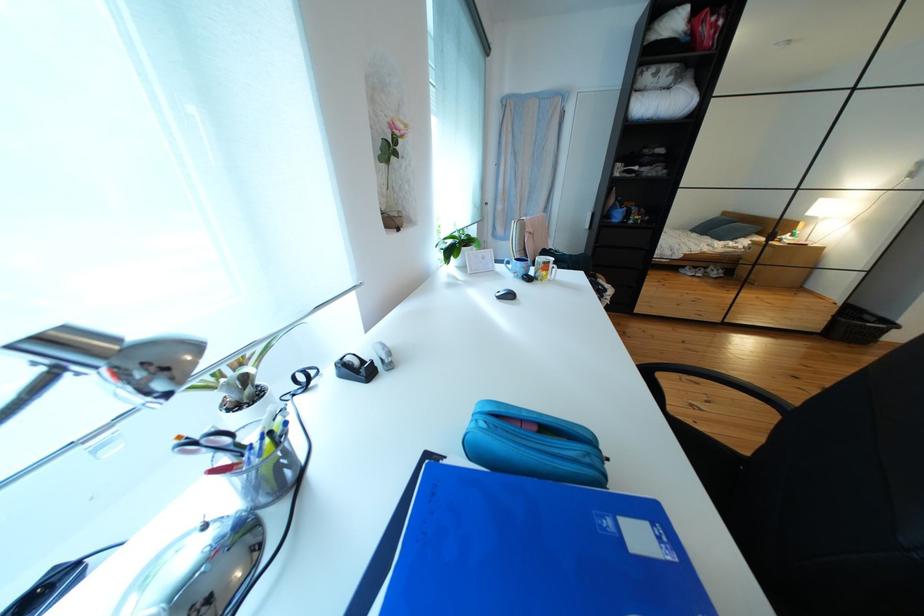
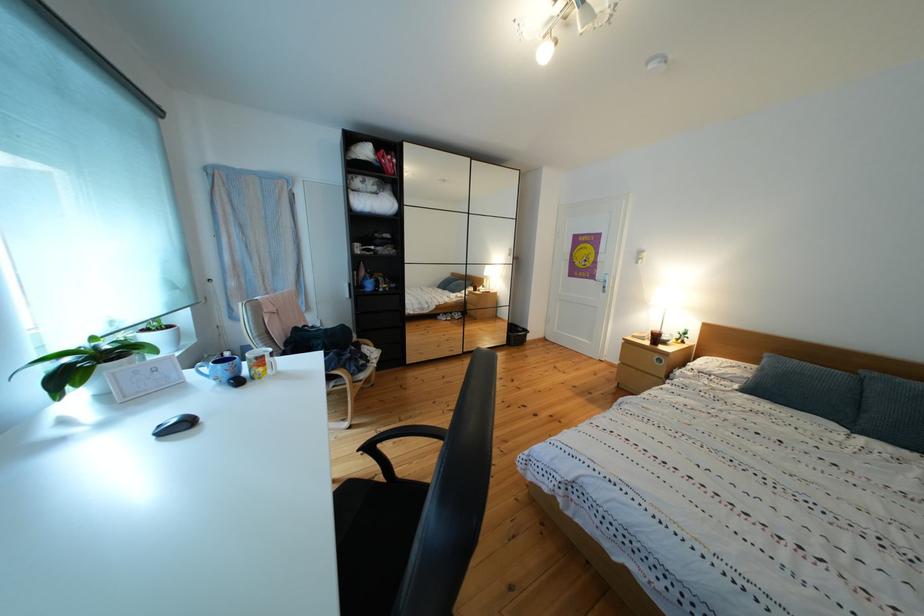
In the second image, find the point that corresponds to [813,301] in the first image.

(508, 326)